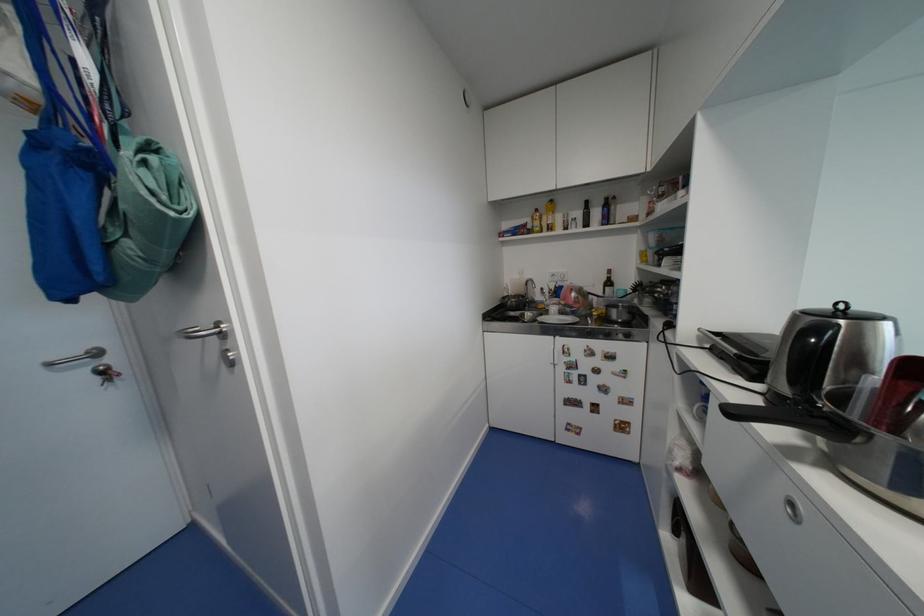
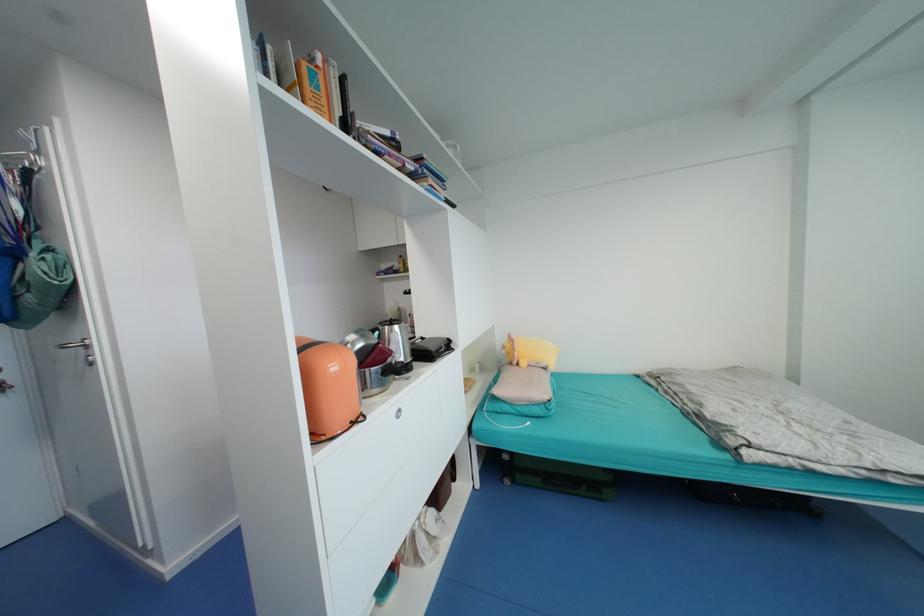
The point at [227,336] is marked in the first image. Where is the corresponding point in the second image?

(91, 347)